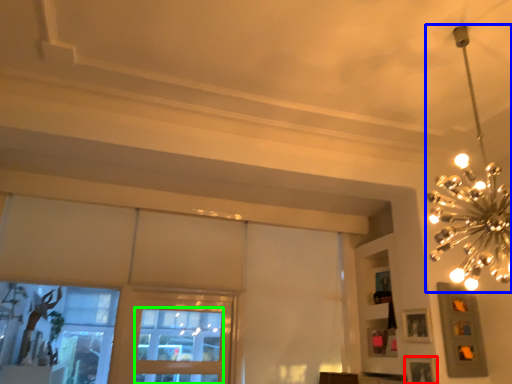
Question: Based on their relative distances, which object is farther from picture frame (highlighted by a red box)? Choose from lamp (highlighted by a blue box) and window (highlighted by a green box).

Choices:
 (A) lamp
 (B) window

Answer: (B)